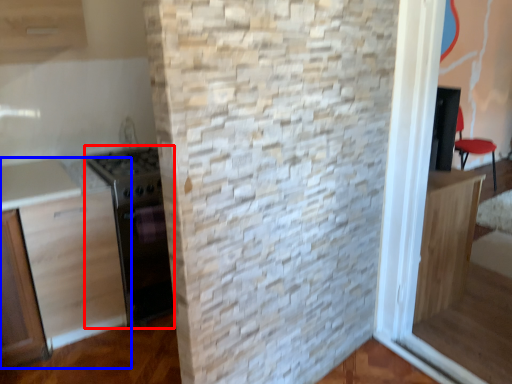
Question: Which point is further to the camera, appliance (highlighted by a red box) or cabinetry (highlighted by a blue box)?

Choices:
 (A) appliance
 (B) cabinetry

Answer: (A)